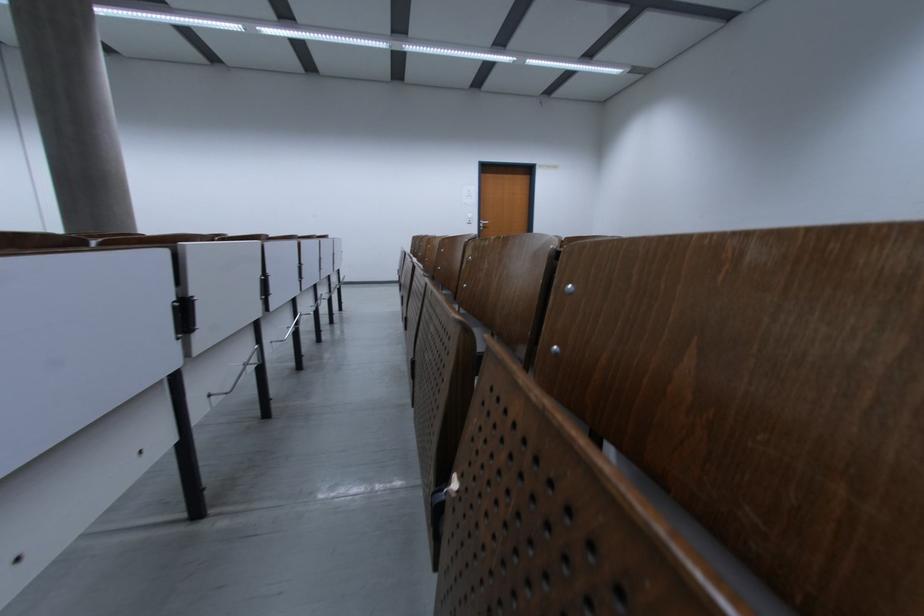
Find where to push the white light switch. Please return your answer as a coordinate pair (x, y).

(468, 195)